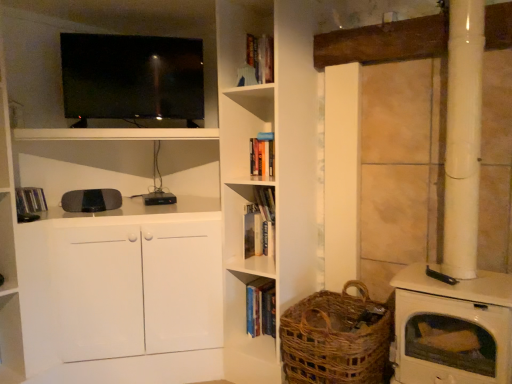
Question: Is hardcover book at center, the first book from the bottom, looking in the opposite direction of hardcover book at left, the 3th book from the bottom?

Choices:
 (A) no
 (B) yes

Answer: (A)

Question: Can you confirm if hardcover book at center, marked as the 1th book in a right-to-left arrangement, is smaller than hardcover book at left, which is the 3th book in right-to-left order?

Choices:
 (A) no
 (B) yes

Answer: (B)

Question: Is hardcover book at center, marked as the 1th book in a right-to-left arrangement, at the right side of hardcover book at left, acting as the 1th book starting from the left?

Choices:
 (A) no
 (B) yes

Answer: (B)

Question: Does hardcover book at center, the first book from the bottom, have a larger size compared to hardcover book at left, acting as the 1th book starting from the left?

Choices:
 (A) no
 (B) yes

Answer: (A)

Question: Is hardcover book at center, the first book from the bottom, further to camera compared to hardcover book at left, which is the 3th book in right-to-left order?

Choices:
 (A) no
 (B) yes

Answer: (B)

Question: Can you confirm if hardcover book at center, the third book positioned from the top, is thinner than hardcover book at left, the 3th book from the bottom?

Choices:
 (A) yes
 (B) no

Answer: (B)

Question: From the image's perspective, is hardcover book at left, which is the 3th book in right-to-left order, located above woven brown basket at lower right?

Choices:
 (A) yes
 (B) no

Answer: (A)

Question: From a real-world perspective, does hardcover book at left, positioned as the first book in top-to-bottom order, sit lower than woven brown basket at lower right?

Choices:
 (A) no
 (B) yes

Answer: (A)

Question: Is woven brown basket at lower right located within hardcover book at left, which is the 3th book in right-to-left order?

Choices:
 (A) no
 (B) yes

Answer: (A)

Question: Considering the relative sizes of hardcover book at left, acting as the 1th book starting from the left, and woven brown basket at lower right in the image provided, is hardcover book at left, acting as the 1th book starting from the left, wider than woven brown basket at lower right?

Choices:
 (A) no
 (B) yes

Answer: (A)

Question: Is hardcover book at left, acting as the 1th book starting from the left, in front of woven brown basket at lower right?

Choices:
 (A) yes
 (B) no

Answer: (B)

Question: Does hardcover book at left, acting as the 1th book starting from the left, appear on the left side of woven brown basket at lower right?

Choices:
 (A) yes
 (B) no

Answer: (A)

Question: Is hardcover book at center, which ranks as the second book in left-to-right order, facing away from matte black tv at upper left?

Choices:
 (A) yes
 (B) no

Answer: (B)